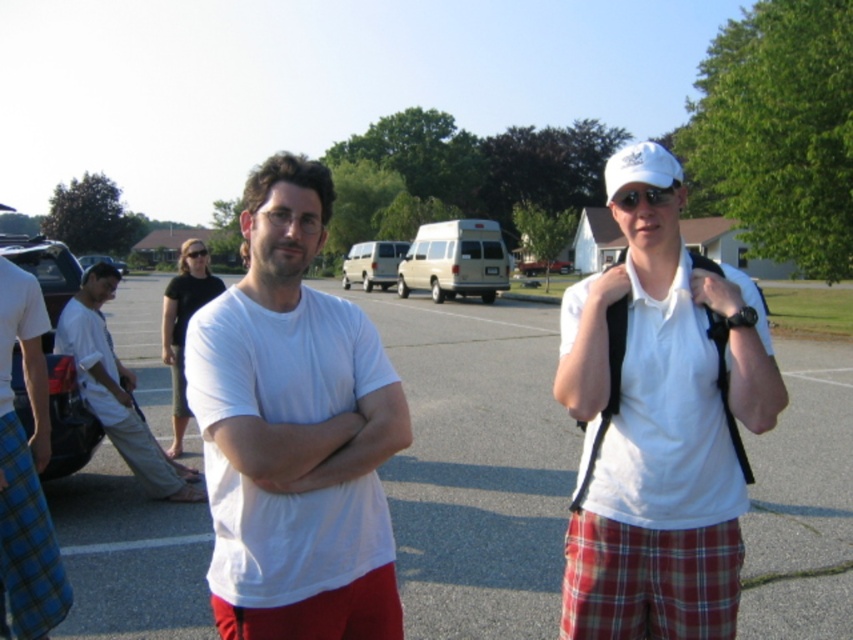
Question: Does blue plaid shorts at lower left appear on the left side of matte black glasses at center?

Choices:
 (A) yes
 (B) no

Answer: (A)

Question: Is gray asphalt parking lot at center behind black cotton shirt at center?

Choices:
 (A) yes
 (B) no

Answer: (B)

Question: Can you confirm if white matte shirt at center is wider than red plaid kilt at center?

Choices:
 (A) yes
 (B) no

Answer: (A)

Question: Which object is the closest to the blue plaid shorts at lower left?

Choices:
 (A) red plaid kilt at center
 (B) plaid cotton shorts at lower right
 (C) blue plaid kilt at lower left

Answer: (C)

Question: Which point is closer to the camera?

Choices:
 (A) white cotton shirt at center
 (B) black cotton shirt at center

Answer: (A)

Question: Which is nearer to the blue plaid shorts at lower left?

Choices:
 (A) plaid cotton shorts at lower right
 (B) red plaid kilt at center

Answer: (B)